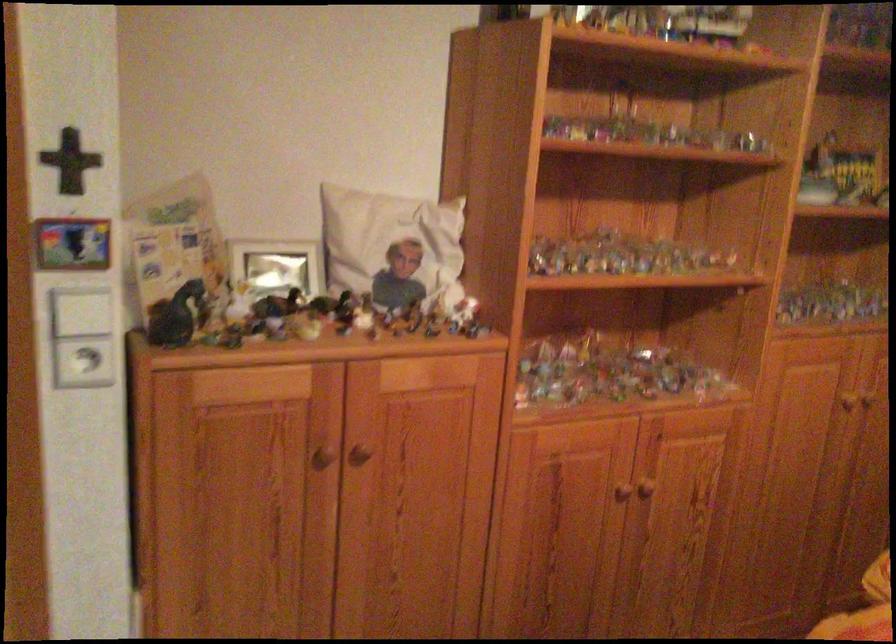
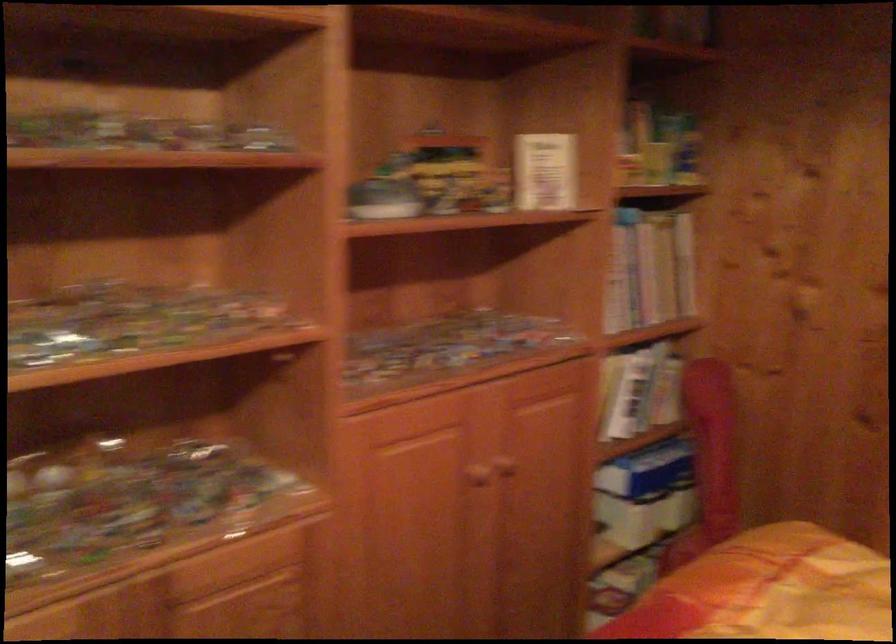
The images are taken continuously from a first-person perspective. In which direction are you moving?

The cameraman moved toward right, forward.